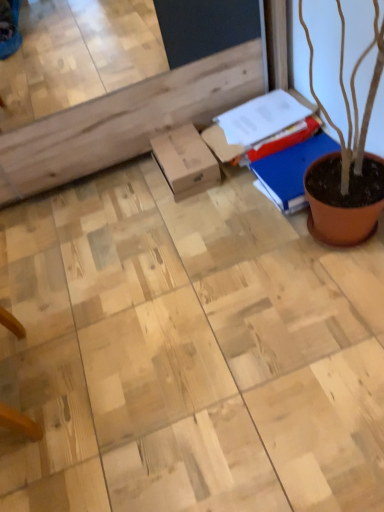
Question: From the image's perspective, is blue matte book at upper right located above cardboard box at center?

Choices:
 (A) no
 (B) yes

Answer: (B)

Question: Does blue matte book at upper right have a lesser width compared to cardboard box at center?

Choices:
 (A) yes
 (B) no

Answer: (B)

Question: Is blue matte book at upper right taller than cardboard box at center?

Choices:
 (A) yes
 (B) no

Answer: (A)

Question: From a real-world perspective, is blue matte book at upper right beneath cardboard box at center?

Choices:
 (A) no
 (B) yes

Answer: (A)

Question: Considering the relative positions of blue matte book at upper right and cardboard box at center in the image provided, is blue matte book at upper right to the left of cardboard box at center from the viewer's perspective?

Choices:
 (A) no
 (B) yes

Answer: (A)

Question: Considering the relative positions of blue matte notebook at right and cardboard box at center in the image provided, is blue matte notebook at right to the left or to the right of cardboard box at center?

Choices:
 (A) left
 (B) right

Answer: (B)

Question: From the image's perspective, relative to cardboard box at center, is blue matte notebook at right above or below?

Choices:
 (A) above
 (B) below

Answer: (B)

Question: Is blue matte notebook at right taller or shorter than cardboard box at center?

Choices:
 (A) tall
 (B) short

Answer: (B)

Question: From a real-world perspective, is blue matte notebook at right above or below cardboard box at center?

Choices:
 (A) above
 (B) below

Answer: (A)

Question: In terms of height, does blue matte book at upper right look taller or shorter compared to blue matte notebook at right?

Choices:
 (A) short
 (B) tall

Answer: (B)

Question: Is point (284, 115) positioned closer to the camera than point (269, 179)?

Choices:
 (A) closer
 (B) farther

Answer: (B)

Question: In the image, is blue matte book at upper right on the left side or the right side of blue matte notebook at right?

Choices:
 (A) right
 (B) left

Answer: (B)

Question: From a real-world perspective, is blue matte book at upper right positioned above or below blue matte notebook at right?

Choices:
 (A) above
 (B) below

Answer: (A)

Question: Looking at the image, does blue matte book at upper right seem bigger or smaller compared to cardboard box at center?

Choices:
 (A) big
 (B) small

Answer: (A)

Question: Is point (281, 150) positioned closer to the camera than point (195, 159)?

Choices:
 (A) closer
 (B) farther

Answer: (A)